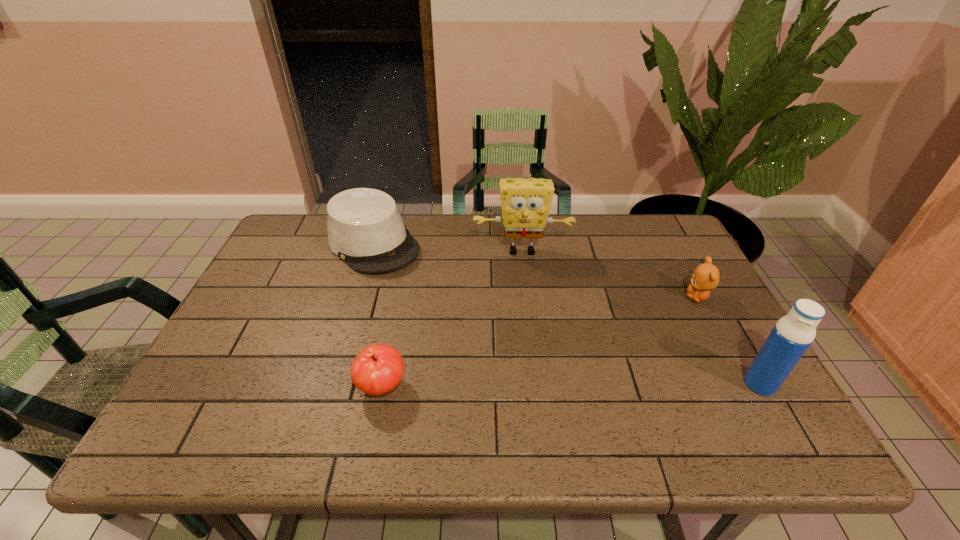
Identify the location of apple. This screenshot has height=540, width=960. click(377, 369).

The width and height of the screenshot is (960, 540). Find the location of `water bottle`. water bottle is located at coordinates (792, 335).

This screenshot has width=960, height=540. Find the location of `teddy bear`. teddy bear is located at coordinates (706, 276).

The height and width of the screenshot is (540, 960). Find the location of `the third object from right to left`. the third object from right to left is located at coordinates point(525,203).

The height and width of the screenshot is (540, 960). Find the location of `hat`. hat is located at coordinates (365, 229).

The image size is (960, 540). Find the location of `free space located on the back of the apple`. free space located on the back of the apple is located at coordinates (396, 319).

You are a GUI agent. You are given a task and a screenshot of the screen. Output one action in this format:
    pyautogui.click(x=<x>, y=<y>)
    Task: Click on the vacant area located 0.190m on the back of the water bottle
    
    Given the screenshot: What is the action you would take?
    pyautogui.click(x=719, y=313)

Where is `vacant region located 0.350m on the face of the third nearest object`? vacant region located 0.350m on the face of the third nearest object is located at coordinates (607, 371).

You are a GUI agent. You are given a task and a screenshot of the screen. Output one action in this format:
    pyautogui.click(x=<x>, y=<y>)
    Task: Click on the blank area located on the face of the third nearest object
    The height and width of the screenshot is (540, 960).
    Given the screenshot: What is the action you would take?
    point(653,334)

The image size is (960, 540). What are the coordinates of `vacant space located on the face of the third nearest object` in the screenshot? It's located at (620, 360).